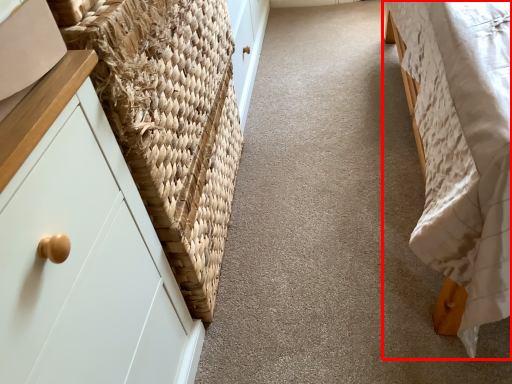
Question: In this image, where is furniture (annotated by the red box) located relative to basket?

Choices:
 (A) right
 (B) left

Answer: (A)